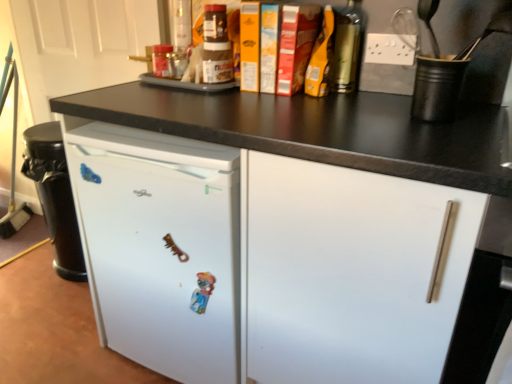
This screenshot has width=512, height=384. Describe the element at coordinates (346, 48) in the screenshot. I see `metallic gold bottle at upper right, which is counted as the second bottle, starting from the left` at that location.

Where is `white matte door at upper left`? white matte door at upper left is located at coordinates (80, 45).

How many degrees apart are the facing directions of black matte cup at upper right and metallic gold bottle at upper right, placed as the 2th bottle when sorted from back to front?

The angle between the facing direction of black matte cup at upper right and the facing direction of metallic gold bottle at upper right, placed as the 2th bottle when sorted from back to front, is 0.00372 degrees.

Considering the points (418, 75) and (335, 54), which point is behind, point (418, 75) or point (335, 54)?

Positioned behind is point (335, 54).

Is black matte cup at upper right turned away from metallic gold bottle at upper right, placed as the 2th bottle when sorted from back to front?

No, black matte cup at upper right is not facing the opposite direction of metallic gold bottle at upper right, placed as the 2th bottle when sorted from back to front.

From the image's perspective, which one is positioned lower, black matte cup at upper right or metallic gold bottle at upper right, which is counted as the second bottle, starting from the left?

black matte cup at upper right, from the image's perspective.

Considering the sizes of translucent plastic jar at upper center, marked as the 2th bottle in a front-to-back arrangement, and white matte drawer at center in the image, is translucent plastic jar at upper center, marked as the 2th bottle in a front-to-back arrangement, taller or shorter than white matte drawer at center?

Clearly, translucent plastic jar at upper center, marked as the 2th bottle in a front-to-back arrangement, is shorter compared to white matte drawer at center.

Is translucent plastic jar at upper center, marked as the 2th bottle in a front-to-back arrangement, turned away from white matte drawer at center?

translucent plastic jar at upper center, marked as the 2th bottle in a front-to-back arrangement, is not turned away from white matte drawer at center.

From the image's perspective, relative to white matte drawer at center, is translucent plastic jar at upper center, acting as the 1th bottle starting from the left, above or below?

Clearly, from the image's perspective, translucent plastic jar at upper center, acting as the 1th bottle starting from the left, is above white matte drawer at center.

Is there a large distance between translucent plastic jar at upper center, the 2th bottle viewed from the right, and white matte drawer at center?

translucent plastic jar at upper center, the 2th bottle viewed from the right, is near white matte drawer at center, not far away.

From a real-world perspective, who is located higher, white matte refrigerator at center or black matte cup at upper right?

From a 3D spatial view, black matte cup at upper right is above.

Does white matte refrigerator at center have a greater height compared to black matte cup at upper right?

Yes.

Would you say white matte refrigerator at center is to the left or to the right of black matte cup at upper right in the picture?

From the image, it's evident that white matte refrigerator at center is to the left of black matte cup at upper right.

Is point (84, 93) more distant than point (422, 94)?

That is True.

From a real-world perspective, is black matte cup at upper right physically below translucent plastic jar at upper center, the 2th bottle viewed from the right?

Incorrect, from a real-world perspective, black matte cup at upper right is higher than translucent plastic jar at upper center, the 2th bottle viewed from the right.

From the image's perspective, is black matte cup at upper right located beneath translucent plastic jar at upper center, acting as the 1th bottle starting from the left?

Correct, black matte cup at upper right appears lower than translucent plastic jar at upper center, acting as the 1th bottle starting from the left, in the image.

How far apart are black matte cup at upper right and translucent plastic jar at upper center, the 2th bottle viewed from the right?

A distance of 34.76 inches exists between black matte cup at upper right and translucent plastic jar at upper center, the 2th bottle viewed from the right.

Can you confirm if black matte cup at upper right is positioned to the left of translucent plastic jar at upper center, marked as the 2th bottle in a front-to-back arrangement?

Incorrect, black matte cup at upper right is not on the left side of translucent plastic jar at upper center, marked as the 2th bottle in a front-to-back arrangement.

Considering the sizes of objects white matte refrigerator at center and white matte drawer at center in the image provided, who is taller, white matte refrigerator at center or white matte drawer at center?

white matte refrigerator at center.

Is the position of white matte refrigerator at center more distant than that of white matte drawer at center?

Yes, white matte refrigerator at center is further from the viewer.

Which is behind, point (244, 119) or point (308, 286)?

The point (244, 119) is more distant.

Is white matte refrigerator at center oriented towards metallic gold bottle at upper right, the first bottle when ordered from right to left?

No, white matte refrigerator at center is not oriented towards metallic gold bottle at upper right, the first bottle when ordered from right to left.

From a real-world perspective, is white matte refrigerator at center physically located above or below metallic gold bottle at upper right, which is counted as the second bottle, starting from the left?

white matte refrigerator at center is below metallic gold bottle at upper right, which is counted as the second bottle, starting from the left.

Considering the positions of point (145, 96) and point (340, 73), is point (145, 96) closer or farther from the camera than point (340, 73)?

Point (145, 96) is positioned closer to the camera compared to point (340, 73).

In the scene shown: In terms of height, does white matte refrigerator at center look taller or shorter compared to metallic gold bottle at upper right, which is the first bottle from front to back?

In the image, white matte refrigerator at center appears to be taller than metallic gold bottle at upper right, which is the first bottle from front to back.

Which is more to the right, white matte refrigerator at center or white matte door at upper left?

Positioned to the right is white matte refrigerator at center.

Is white matte refrigerator at center not within white matte door at upper left?

Yes, white matte refrigerator at center is located beyond the bounds of white matte door at upper left.

Identify the location of cabinetry below the white matte door at upper left (from a real-world perspective). (329, 135).

You are a GUI agent. You are given a task and a screenshot of the screen. Output one action in this format:
    pyautogui.click(x=<x>, y=<y>)
    Task: Click on the 1st bottle behind the black matte cup at upper right
    This screenshot has width=512, height=384.
    Given the screenshot: What is the action you would take?
    pyautogui.click(x=346, y=48)

From the white matte drawer at center, count the 2nd bottle to the left and point to it. Please provide its 2D coordinates.

[(162, 60)]

Considering their positions, is black matte cup at upper right positioned closer to white matte door at upper left than translucent plastic jar at upper center, the 2th bottle viewed from the right?

translucent plastic jar at upper center, the 2th bottle viewed from the right, lies closer to white matte door at upper left than the other object.

Based on their spatial positions, is white matte drawer at center or metallic gold bottle at upper right, the first bottle when ordered from right to left, closer to black matte cup at upper right?

Among the two, metallic gold bottle at upper right, the first bottle when ordered from right to left, is located nearer to black matte cup at upper right.

Considering their positions, is translucent plastic jar at upper center, acting as the 1th bottle starting from the left, positioned further to white matte door at upper left than metallic gold bottle at upper right, which is the first bottle from front to back?

metallic gold bottle at upper right, which is the first bottle from front to back.

Which object lies further to the anchor point white matte drawer at center, metallic gold bottle at upper right, which is counted as the second bottle, starting from the left, or white matte refrigerator at center?

metallic gold bottle at upper right, which is counted as the second bottle, starting from the left, lies further to white matte drawer at center than the other object.

Estimate the real-world distances between objects in this image. Which object is further from white matte refrigerator at center, white matte door at upper left or black matte cup at upper right?

white matte door at upper left.

Which object lies nearer to the anchor point metallic gold bottle at upper right, the first bottle when ordered from right to left, white matte door at upper left or white matte drawer at center?

Among the two, white matte drawer at center is located nearer to metallic gold bottle at upper right, the first bottle when ordered from right to left.

Looking at this image, when comparing their distances from metallic gold bottle at upper right, which is the first bottle from front to back, does white matte drawer at center or black matte cup at upper right seem further?

white matte drawer at center is further to metallic gold bottle at upper right, which is the first bottle from front to back.

Estimate the real-world distances between objects in this image. Which object is further from black matte cup at upper right, metallic gold bottle at upper right, the first bottle when ordered from right to left, or white matte refrigerator at center?

Among the two, metallic gold bottle at upper right, the first bottle when ordered from right to left, is located further to black matte cup at upper right.

Find the location of a particular element. drawer between white matte door at upper left and black matte cup at upper right in the horizontal direction is located at coordinates (352, 272).

Identify the location of drawer between translucent plastic jar at upper center, the 2th bottle viewed from the right, and black matte cup at upper right. (352, 272).

In order to click on bottle between translucent plastic jar at upper center, acting as the 1th bottle starting from the left, and black matte cup at upper right, in the horizontal direction in this screenshot , I will do `click(346, 48)`.

What are the coordinates of `bottle between white matte refrigerator at center and black matte cup at upper right` in the screenshot? It's located at (346, 48).